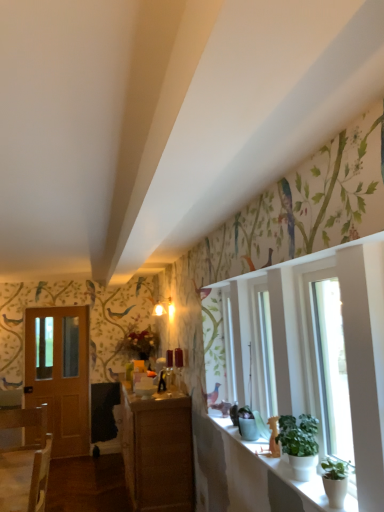
This screenshot has height=512, width=384. What do you see at coordinates (255, 477) in the screenshot?
I see `white ceramic window sill at lower right` at bounding box center [255, 477].

Where is `wooden chair at lower left`? The height and width of the screenshot is (512, 384). wooden chair at lower left is located at coordinates (25, 478).

Where is `wooden door at left`? Image resolution: width=384 pixels, height=512 pixels. wooden door at left is located at coordinates (60, 374).

Where is `wooden cabinet at center`? The image size is (384, 512). wooden cabinet at center is located at coordinates (158, 450).

Locate an element on the screen. This screenshot has height=512, width=384. green matte plant at lower right, which appears as the 2th houseplant when viewed from the front is located at coordinates point(300,444).

From the image's perspective, is green matte plant at lower right, which is the first houseplant from back to front, under wooden cabinet at center?

No, from the image's perspective, green matte plant at lower right, which is the first houseplant from back to front, is not below wooden cabinet at center.

Is wooden cabinet at center located within green matte plant at lower right, which appears as the 2th houseplant when viewed from the front?

No.

Which object is closer to the camera, green matte plant at lower right, which appears as the 2th houseplant when viewed from the front, or wooden cabinet at center?

Positioned in front is green matte plant at lower right, which appears as the 2th houseplant when viewed from the front.

Considering the positions of points (289, 422) and (161, 458), is point (289, 422) farther from camera compared to point (161, 458)?

No, it is not.

Looking at this image, considering the relative sizes of wooden door at left and wooden cabinet at center in the image provided, is wooden door at left taller than wooden cabinet at center?

Yes.

From the image's perspective, is wooden door at left located above or below wooden cabinet at center?

From the image's perspective, wooden door at left appears above wooden cabinet at center.

Is point (55, 440) behind point (156, 469)?

Yes, it is.

Is the depth of wooden door at left greater than that of wooden cabinet at center?

Yes, wooden door at left is further from the camera.

Where is `chair in front of the wooden cabinet at center`? chair in front of the wooden cabinet at center is located at coordinates (25, 478).

Considering the positions of objects wooden chair at lower left and wooden cabinet at center in the image provided, who is behind, wooden chair at lower left or wooden cabinet at center?

Positioned behind is wooden cabinet at center.

Can you see wooden chair at lower left touching wooden cabinet at center?

No, wooden chair at lower left is not touching wooden cabinet at center.

From a real-world perspective, is transparent glass window at right physically above wooden door at left?

Yes, from a real-world perspective, transparent glass window at right is over wooden door at left

Is transparent glass window at right facing towards wooden door at left?

No, transparent glass window at right is not aimed at wooden door at left.

Does transparent glass window at right have a larger size compared to wooden door at left?

Incorrect, transparent glass window at right is not larger than wooden door at left.

The height and width of the screenshot is (512, 384). In order to click on window in front of the wooden door at left in this screenshot , I will do `click(328, 366)`.

Is green matte plant at lower right, the 1th houseplant positioned from the front, completely or partially outside of wooden door at left?

green matte plant at lower right, the 1th houseplant positioned from the front, is positioned outside wooden door at left.

Can you confirm if green matte plant at lower right, the 1th houseplant positioned from the front, is bigger than wooden door at left?

Actually, green matte plant at lower right, the 1th houseplant positioned from the front, might be smaller than wooden door at left.

Is green matte plant at lower right, the 1th houseplant positioned from the front, thinner than wooden door at left?

No.

Which is closer, (x=339, y=484) or (x=75, y=369)?

The point (x=339, y=484) is more forward.

Which object is closer to the camera taking this photo, transparent glass window at right or green matte plant at lower right, which appears as the 2th houseplant when viewed from the front?

transparent glass window at right.

Can you confirm if transparent glass window at right is smaller than green matte plant at lower right, which appears as the 2th houseplant when viewed from the front?

Incorrect, transparent glass window at right is not smaller in size than green matte plant at lower right, which appears as the 2th houseplant when viewed from the front.

Between point (317, 344) and point (282, 423), which one is positioned in front?

The point (317, 344) is closer to the camera.

Are transparent glass window at right and green matte plant at lower right, which appears as the 2th houseplant when viewed from the front, making contact?

transparent glass window at right is not next to green matte plant at lower right, which appears as the 2th houseplant when viewed from the front, and they're not touching.

Considering the relative positions of green matte plant at lower right, the 1th houseplant positioned from the front, and wooden chair at lower left in the image provided, is green matte plant at lower right, the 1th houseplant positioned from the front, to the right of wooden chair at lower left from the viewer's perspective?

Yes, green matte plant at lower right, the 1th houseplant positioned from the front, is to the right of wooden chair at lower left.

Which of these two, green matte plant at lower right, the second houseplant from the back, or wooden chair at lower left, is smaller?

green matte plant at lower right, the second houseplant from the back, is smaller.

How different are the orientations of green matte plant at lower right, the second houseplant from the back, and wooden chair at lower left in degrees?

85.2 degrees.

From the picture: From a real-world perspective, does green matte plant at lower right, the second houseplant from the back, sit lower than wooden chair at lower left?

No.

Where is `the 2nd houseplant directly above the wooden cabinet at center (from a real-world perspective)`? Image resolution: width=384 pixels, height=512 pixels. the 2nd houseplant directly above the wooden cabinet at center (from a real-world perspective) is located at coordinates (300, 444).

Identify the location of cabinetry lying in front of the wooden door at left. (158, 450).

Estimate the real-world distances between objects in this image. Which object is closer to transparent glass window at right, wooden chair at lower left or green matte plant at lower right, the 1th houseplant positioned from the front?

The object closer to transparent glass window at right is green matte plant at lower right, the 1th houseplant positioned from the front.

Which object lies further to the anchor point transparent glass window at right, white ceramic window sill at lower right or wooden door at left?

wooden door at left.

Estimate the real-world distances between objects in this image. Which object is closer to wooden chair at lower left, wooden door at left or green matte plant at lower right, the second houseplant from the back?

green matte plant at lower right, the second houseplant from the back, is closer to wooden chair at lower left.

When comparing their distances from wooden door at left, does transparent glass window at right or white ceramic window sill at lower right seem further?

Among the two, transparent glass window at right is located further to wooden door at left.

When comparing their distances from white ceramic window sill at lower right, does wooden cabinet at center or transparent glass window at right seem further?

Based on the image, wooden cabinet at center appears to be further to white ceramic window sill at lower right.

Considering their positions, is green matte plant at lower right, which is the first houseplant from back to front, positioned closer to wooden cabinet at center than wooden door at left?

wooden door at left is closer to wooden cabinet at center.

From the image, which object appears to be farther from green matte plant at lower right, the 1th houseplant positioned from the front, wooden chair at lower left or green matte plant at lower right, which is the first houseplant from back to front?

wooden chair at lower left lies further to green matte plant at lower right, the 1th houseplant positioned from the front, than the other object.

Looking at the image, which one is located further to green matte plant at lower right, which appears as the 2th houseplant when viewed from the front, wooden cabinet at center or white ceramic window sill at lower right?

Among the two, wooden cabinet at center is located further to green matte plant at lower right, which appears as the 2th houseplant when viewed from the front.

Locate an element on the screen. chair between transparent glass window at right and wooden cabinet at center in the front-back direction is located at coordinates [25, 478].

Identify the location of houseplant between wooden chair at lower left and green matte plant at lower right, the 1th houseplant positioned from the front, from left to right. (300, 444).

Locate an element on the screen. Image resolution: width=384 pixels, height=512 pixels. cabinetry between white ceramic window sill at lower right and wooden door at left along the z-axis is located at coordinates (158, 450).

Find the location of a particular element. Image resolution: width=384 pixels, height=512 pixels. chair between green matte plant at lower right, which is the first houseplant from back to front, and wooden door at left from front to back is located at coordinates (25, 478).